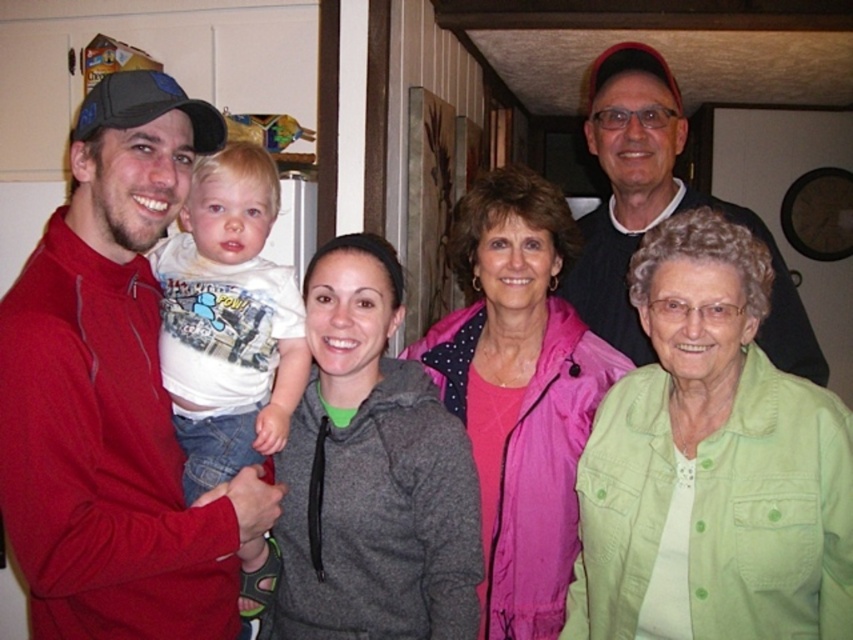
You are a photographer setting up for a family photo in a hallway with wooden walls. You notice two jackets hanging on a hook in the center of the hallway. The gray fleece jacket at center and the pink fabric jacket at center. Which jacket is lower on the hook?

The gray fleece jacket at center is located below the pink fabric jacket at center, so the gray fleece jacket at center is lower on the hook.